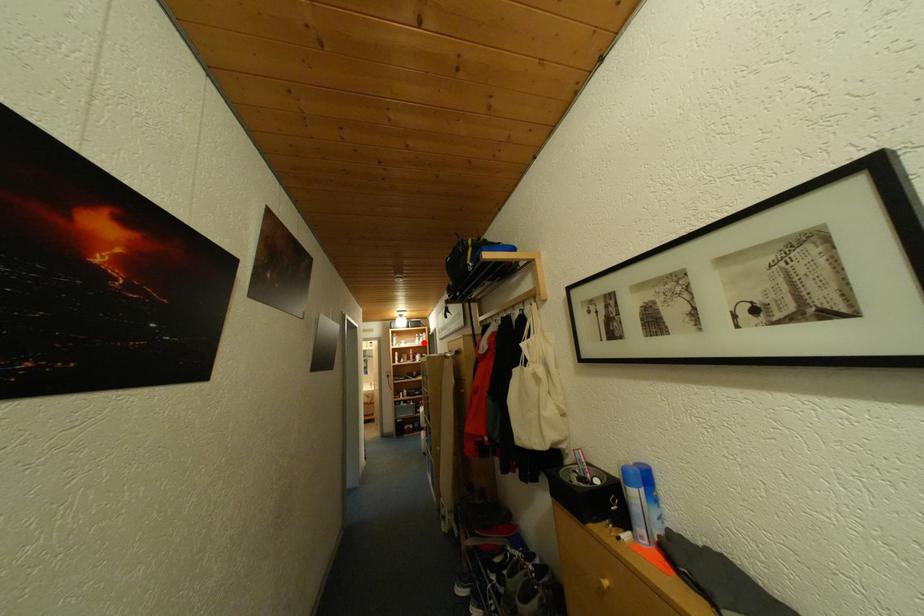
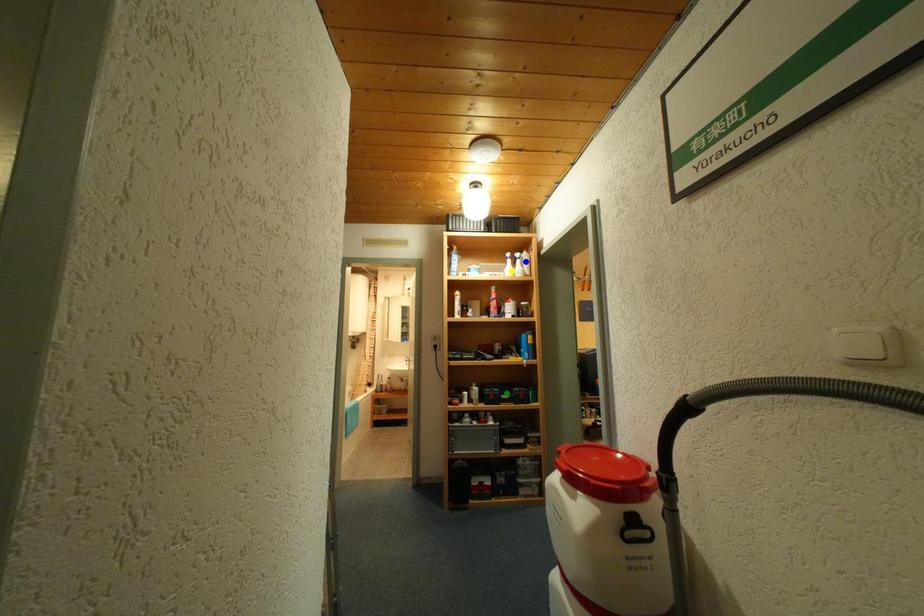
Question: I am providing you with two images of the same scene from different viewpoints. A red point is marked on the first image. You are given multiple points on the second image. Can you choose the point in image 2 that corresponds to the point in image 1?

Choices:
 (A) blue point
 (B) yellow point
 (C) green point

Answer: (B)